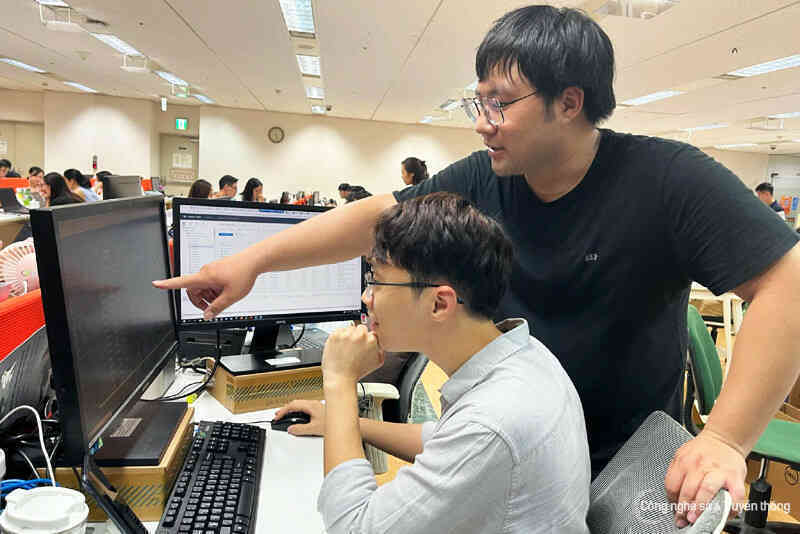
Image resolution: width=800 pixels, height=534 pixels. I want to click on coffee cup lid, so click(64, 497).